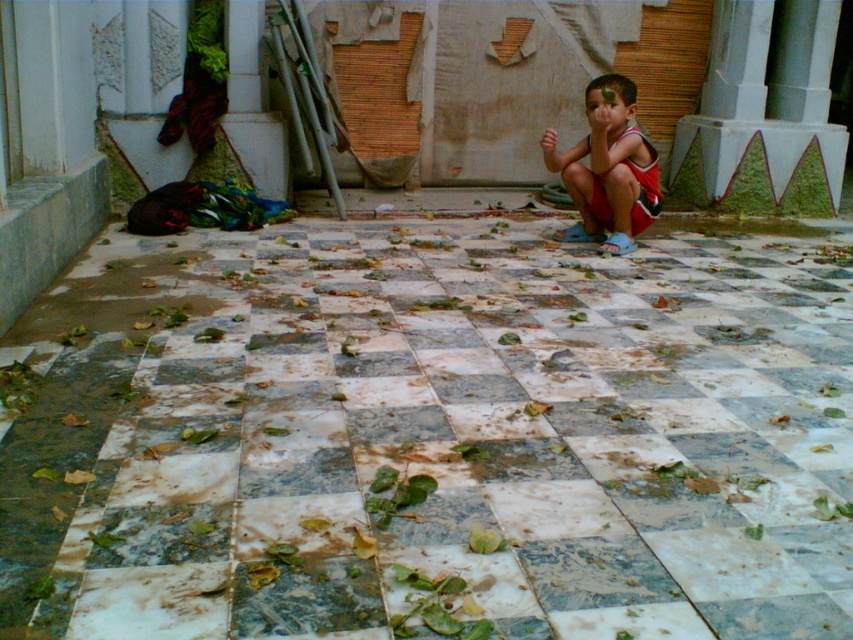
You are standing at the point marked by the coordinates point (433, 436). Looking around, you see the marble tile at center. Which direction should you move to avoid stepping on the scattered green leaves?

The marble tile at center is located at point (433, 436). Since the green leaves are scattered across the floor, moving towards the concrete wall with exposed brickwork and plaster patches would keep you off the leaves.